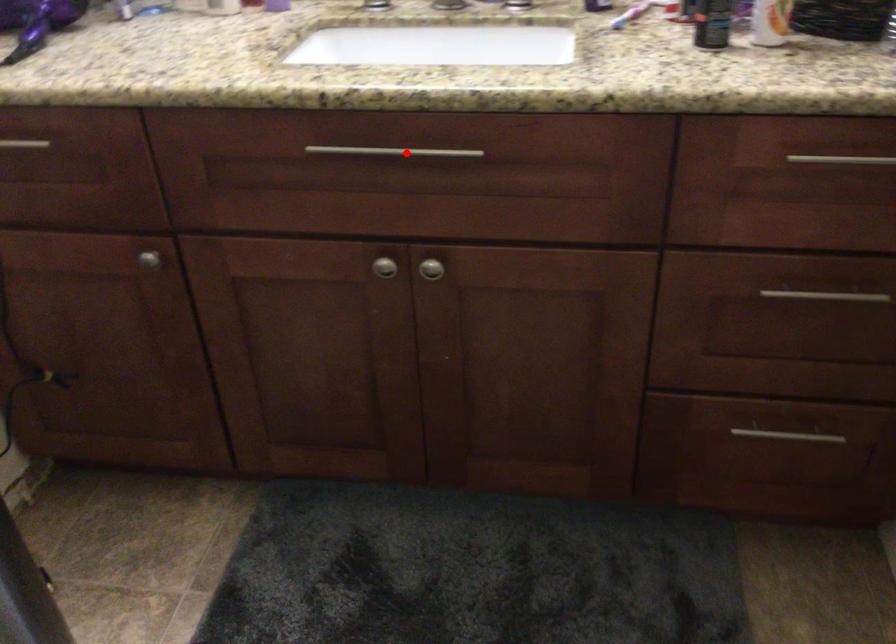
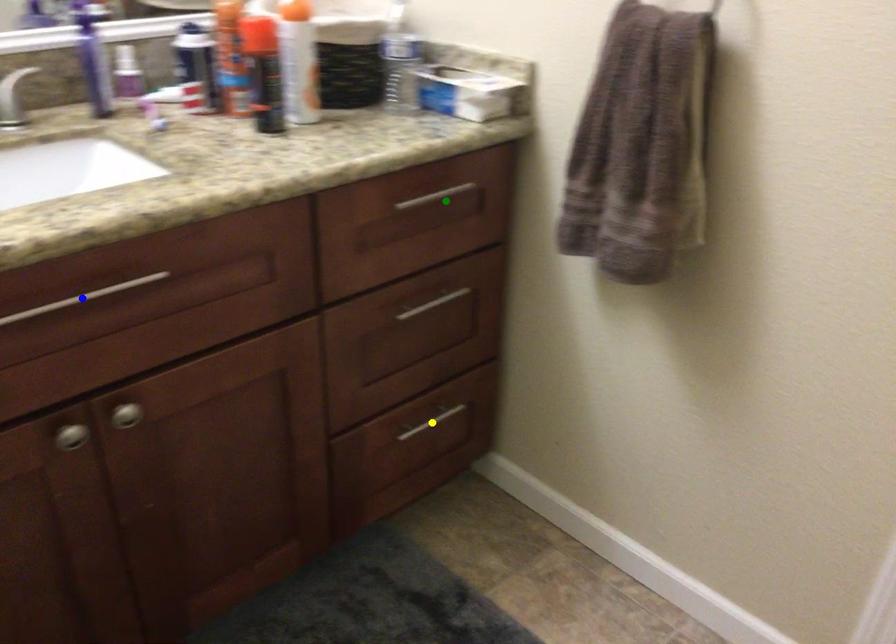
Question: I am providing you with two images of the same scene from different viewpoints. A red point is marked on the first image. You are given multiple points on the second image. Which point in image 2 is actually the same real-world point as the red point in image 1?

Choices:
 (A) yellow point
 (B) green point
 (C) blue point

Answer: (C)